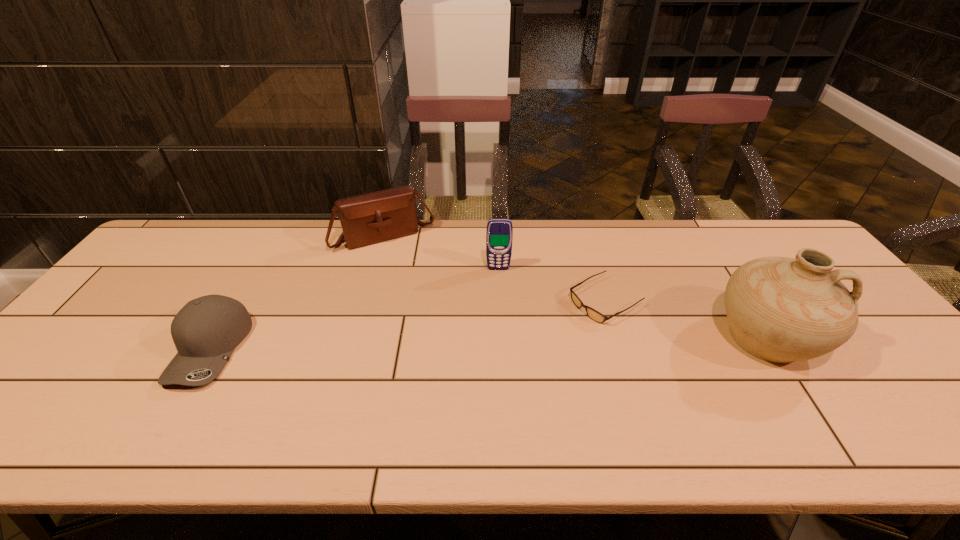
Identify the location of vacant region located 0.150m on the back of the tallest object. Image resolution: width=960 pixels, height=540 pixels. (721, 266).

I want to click on free point located 0.250m on the front-facing side of the third object from left to right, so [x=501, y=333].

Identify the location of free space located on the front-facing side of the third object from left to right. The image size is (960, 540). (502, 364).

Locate an element on the screen. The image size is (960, 540). free space located 0.120m on the front-facing side of the third object from left to right is located at coordinates (499, 298).

This screenshot has height=540, width=960. What are the coordinates of `vacant space located 0.340m on the front-facing side of the sunglasses` in the screenshot? It's located at (474, 375).

Image resolution: width=960 pixels, height=540 pixels. What are the coordinates of `vacant space located on the front-facing side of the sunglasses` in the screenshot? It's located at (520, 349).

You are a GUI agent. You are given a task and a screenshot of the screen. Output one action in this format:
    pyautogui.click(x=<x>, y=<y>)
    Task: Click on the free space located on the front-facing side of the sunglasses
    This screenshot has height=540, width=960.
    Given the screenshot: What is the action you would take?
    pyautogui.click(x=554, y=330)

Identify the location of vacant point located on the front flap of the farthest object. Image resolution: width=960 pixels, height=540 pixels. (412, 272).

This screenshot has width=960, height=540. I want to click on free space located on the front flap of the farthest object, so click(x=440, y=322).

This screenshot has height=540, width=960. Identify the location of free space located on the front flap of the farthest object. (419, 284).